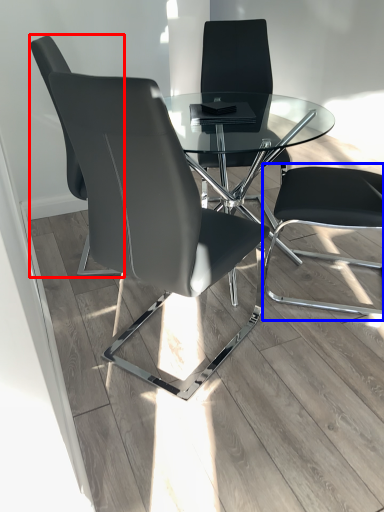
Question: Which object is further to the camera taking this photo, chair (highlighted by a red box) or computer chair (highlighted by a blue box)?

Choices:
 (A) chair
 (B) computer chair

Answer: (A)